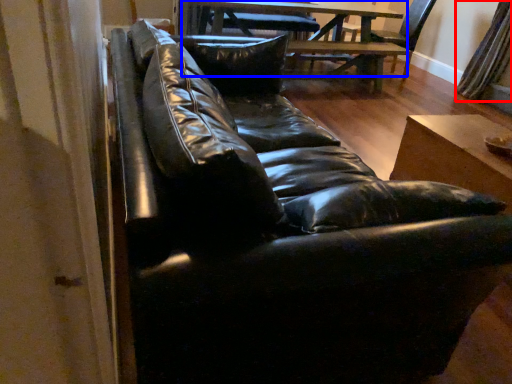
Question: Among these objects, which one is farthest to the camera, curtain (highlighted by a red box) or table (highlighted by a blue box)?

Choices:
 (A) curtain
 (B) table

Answer: (A)